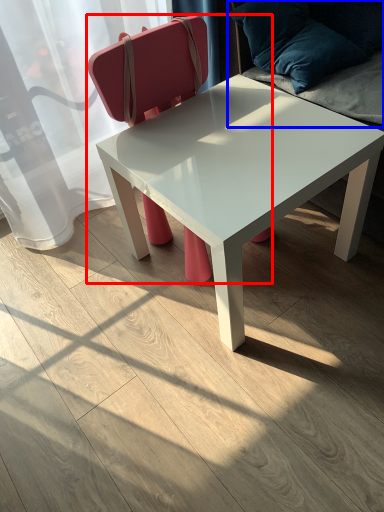
Question: Which object appears farthest to the camera in this image, chair (highlighted by a red box) or swivel chair (highlighted by a blue box)?

Choices:
 (A) chair
 (B) swivel chair

Answer: (B)